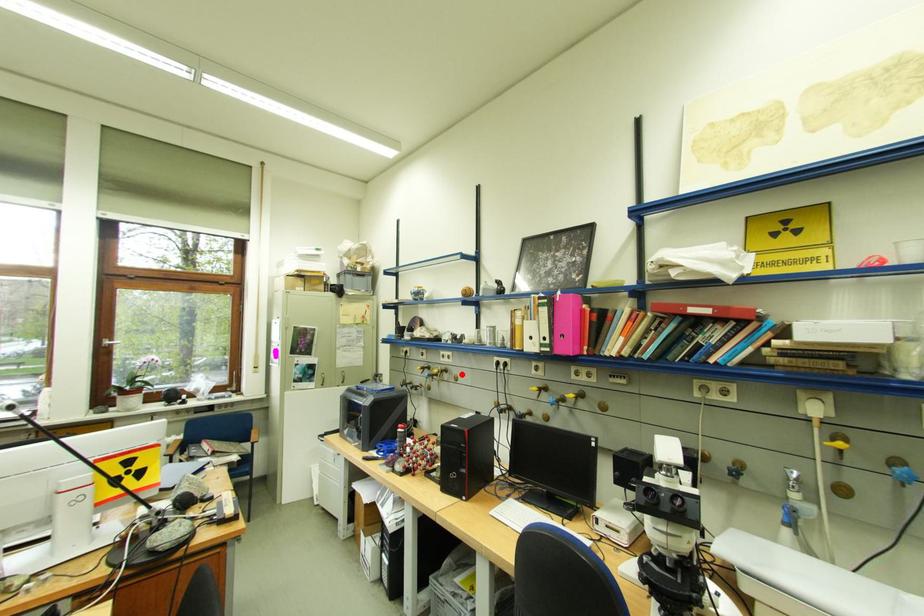
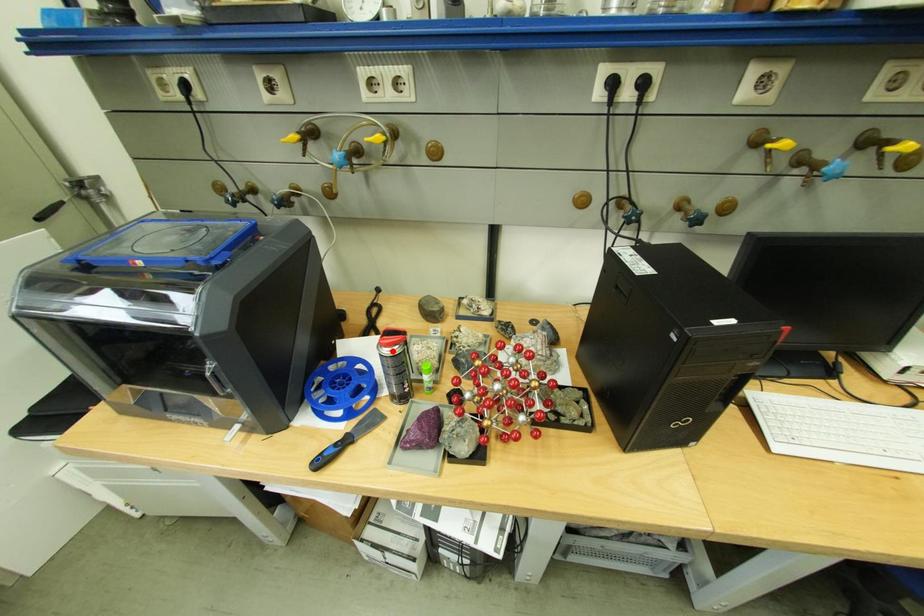
I am providing you with two images of the same scene from different viewpoints. A red point is marked on the first image and another point is marked on the second image. Is the marked point in image1 the same physical position as the marked point in image2?

No